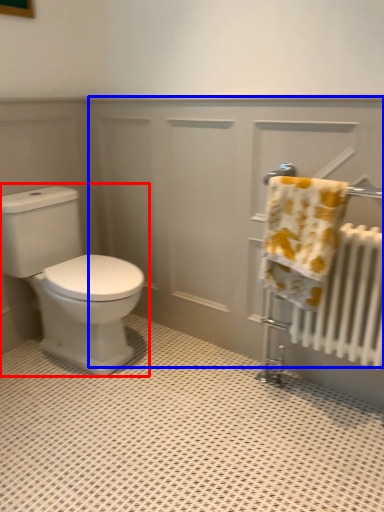
Question: Among these objects, which one is farthest to the camera, toilet (highlighted by a red box) or screen door (highlighted by a blue box)?

Choices:
 (A) toilet
 (B) screen door

Answer: (A)